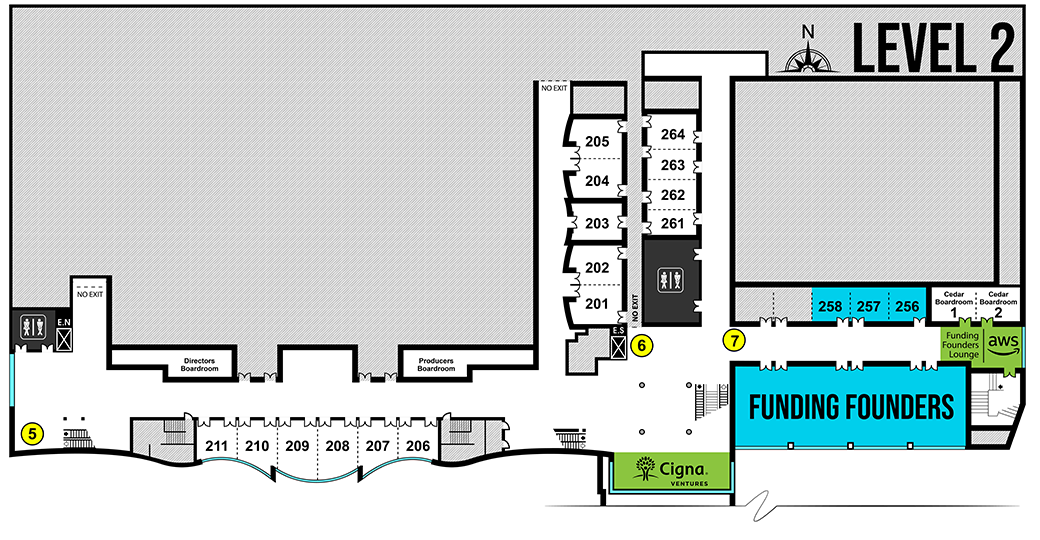
You are a GUI agent. You are given a task and a screenshot of the screen. Output one action in this format:
    pyautogui.click(x=<x>, y=<y>)
    Task: Click on the rooms signified by the color blue
    The image size is (1040, 540).
    Given the screenshot: What is the action you would take?
    point(860,413), point(832,302), point(869,302), point(907,300)